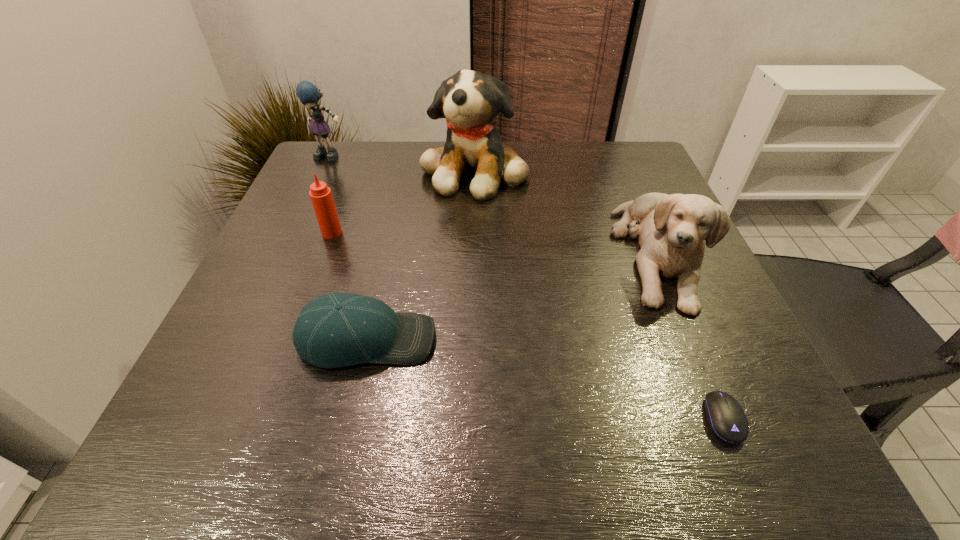
This screenshot has height=540, width=960. I want to click on baseball cap present at the left edge, so click(x=336, y=330).

The image size is (960, 540). Identify the location of puppy present at the right edge. (672, 229).

Locate an element on the screen. The image size is (960, 540). computer mouse that is positioned at the right edge is located at coordinates (725, 416).

Where is `object positioned at the far left corner`? This screenshot has height=540, width=960. object positioned at the far left corner is located at coordinates (307, 92).

Where is `object that is at the near right corner`? The image size is (960, 540). object that is at the near right corner is located at coordinates (725, 416).

This screenshot has height=540, width=960. In the image, there is a desktop. What are the coordinates of `vacant space at the far edge` in the screenshot? It's located at (594, 187).

In the image, there is a desktop. Where is `vacant space at the near edge`? This screenshot has width=960, height=540. vacant space at the near edge is located at coordinates (493, 436).

You are a GUI agent. You are given a task and a screenshot of the screen. Output one action in this format:
    pyautogui.click(x=<x>, y=<y>)
    Task: Click on the vacant space at the left edge
    The image size is (960, 540).
    Given the screenshot: What is the action you would take?
    pyautogui.click(x=282, y=244)

The image size is (960, 540). Find the location of `free region at the right edge`. free region at the right edge is located at coordinates (718, 327).

In the image, there is a desktop. At what (x,y) coordinates should I click in order to perform the action: click on vacant space at the near left corner. Please return your answer as a coordinate pair (x, y). The image size is (960, 540). Looking at the image, I should click on (181, 417).